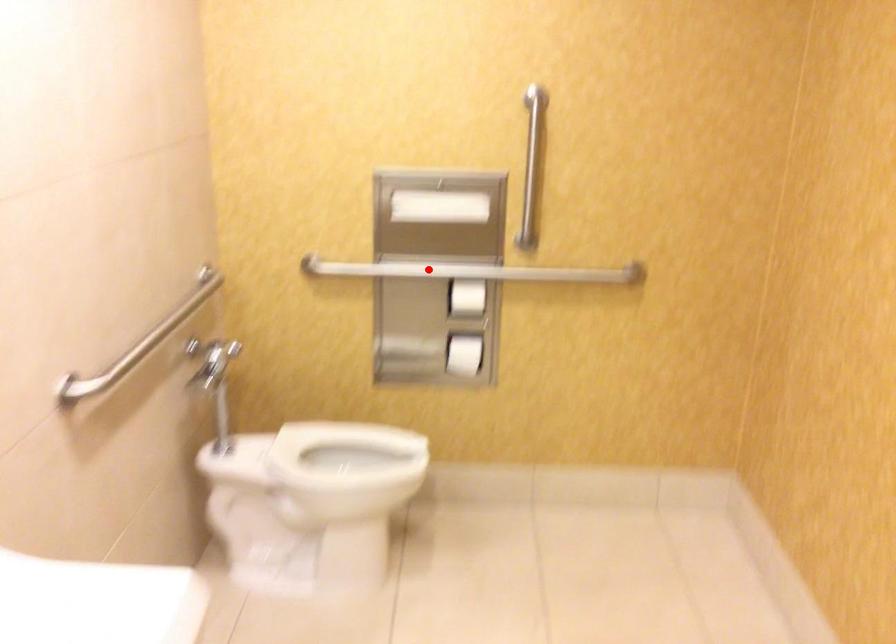
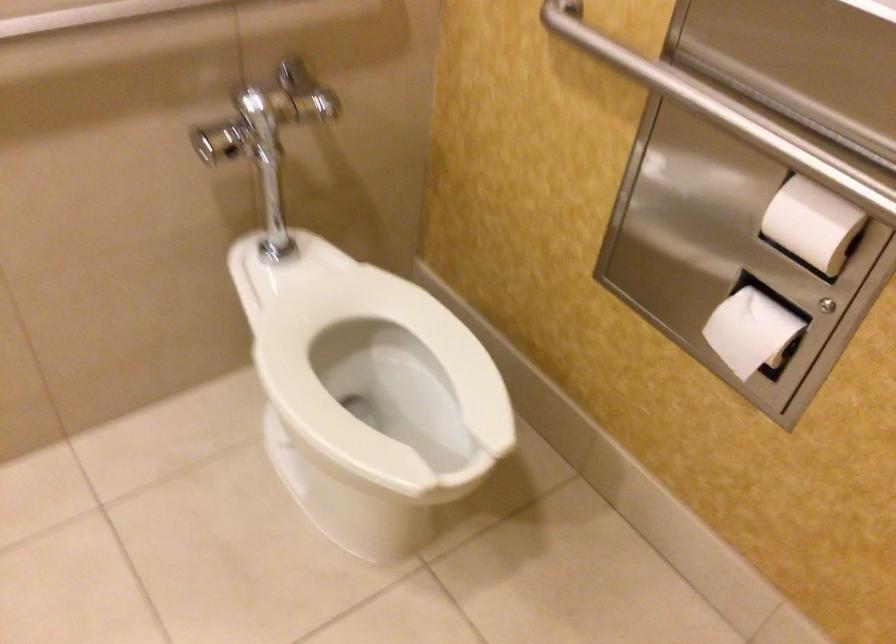
Question: I am providing you with two images of the same scene from different viewpoints. In image1, a red point is highlighted. Considering the same 3D point in image2, which of the following is correct?

Choices:
 (A) It is closer
 (B) It is farther

Answer: (A)